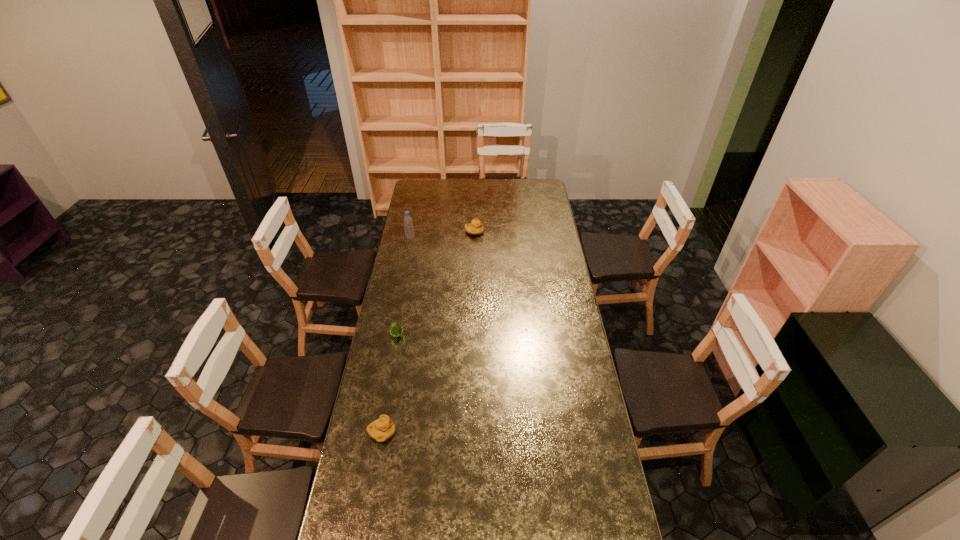
You are a GUI agent. You are given a task and a screenshot of the screen. Output one action in this format:
    pyautogui.click(x=<x>, y=<y>)
    Task: Click on the bottle that is at the left edge
    
    Given the screenshot: What is the action you would take?
    pyautogui.click(x=408, y=222)

Identify the location of avocado that is positioned at the left edge. (395, 329).

I want to click on duckling present at the left edge, so click(x=383, y=428).

This screenshot has height=540, width=960. Identify the location of vacant point at the far edge. (514, 195).

Find the location of a particular element. The height and width of the screenshot is (540, 960). vacant space at the left edge of the desktop is located at coordinates (x=356, y=445).

Locate an element on the screen. The width and height of the screenshot is (960, 540). vacant space at the right edge is located at coordinates (539, 244).

In the image, there is a desktop. Find the location of `vacant space at the far left corner`. vacant space at the far left corner is located at coordinates (414, 193).

At what (x,y) coordinates should I click in order to perform the action: click on free space between the avocado and the tallest object. Please return your answer as a coordinate pair (x, y). Image resolution: width=960 pixels, height=540 pixels. Looking at the image, I should click on (403, 287).

Where is `free point between the avocado and the nearer duckling`? This screenshot has height=540, width=960. free point between the avocado and the nearer duckling is located at coordinates (390, 384).

At what (x,y) coordinates should I click in order to perform the action: click on empty location between the bottle and the rightmost object. Please return your answer as a coordinate pair (x, y). Looking at the image, I should click on (443, 235).